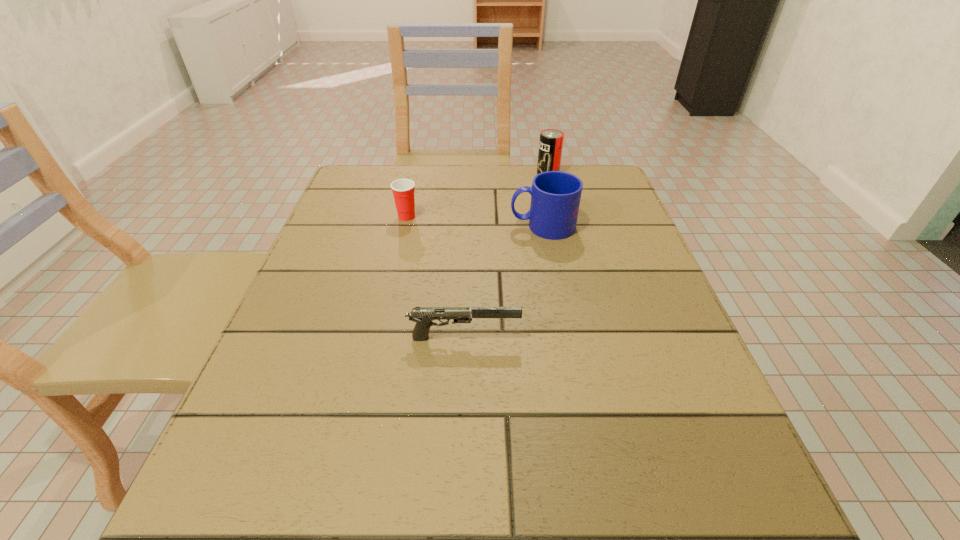
Locate an element on the screen. This screenshot has height=540, width=960. can is located at coordinates (551, 140).

Locate an element on the screen. The width and height of the screenshot is (960, 540). mug is located at coordinates (555, 195).

Find the location of a particular element. Dixie cup is located at coordinates (403, 190).

This screenshot has height=540, width=960. Identify the location of the nearest object. (423, 316).

Locate an element on the screen. the shortest object is located at coordinates (423, 316).

Locate an element on the screen. free spot located on the front of the farthest object is located at coordinates (557, 210).

Identify the location of vacant region located on the side with the handle of the mug. (439, 226).

Find the location of a particular element. The height and width of the screenshot is (540, 960). vacant space located on the side with the handle of the mug is located at coordinates (421, 226).

Find the location of a particular element. This screenshot has height=540, width=960. vacant region located 0.090m on the side with the handle of the mug is located at coordinates (470, 226).

The width and height of the screenshot is (960, 540). In order to click on vacant space situated 0.390m on the front of the Dixie cup in this screenshot , I will do `click(374, 359)`.